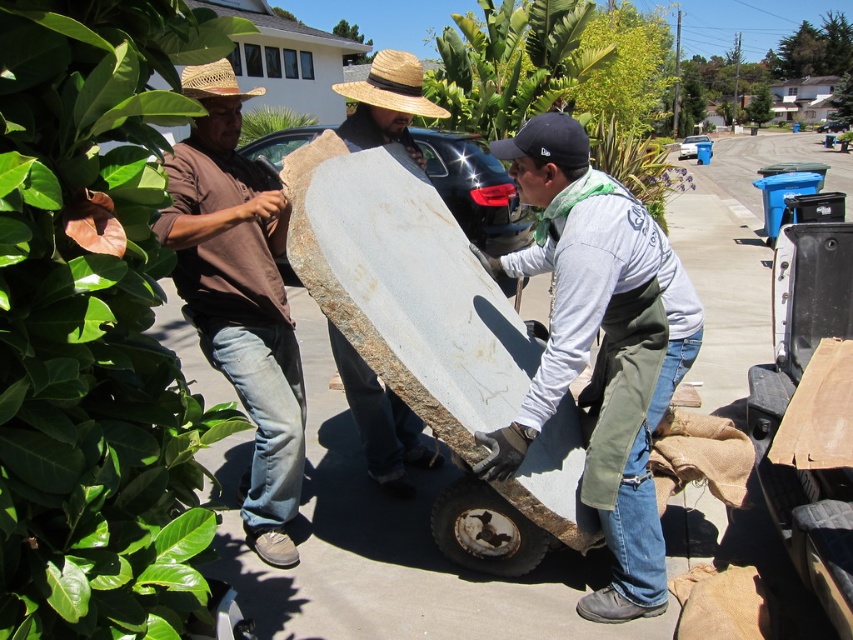
This screenshot has height=640, width=853. What are the coordinates of `matte gray concrete at center` in the screenshot? It's located at (601, 346).

Based on the photo, between matte gray concrete at center and strawhat at left, which one appears on the right side from the viewer's perspective?

Positioned to the right is matte gray concrete at center.

Does point (699, 316) come farther from viewer compared to point (189, 83)?

That is False.

What are the coordinates of `matte gray concrete at center` in the screenshot? It's located at (601, 346).

Does matte gray concrete at center have a greater height compared to brown cotton shirt at left?

In fact, matte gray concrete at center may be shorter than brown cotton shirt at left.

Looking at this image, how far apart are matte gray concrete at center and brown cotton shirt at left?

They are 4.06 feet apart.

Between point (660, 244) and point (264, 312), which one is positioned behind?

The point (264, 312) is behind.

The image size is (853, 640). What are the coordinates of `matte gray concrete at center` in the screenshot? It's located at (601, 346).

Which of these two, matte concrete slab at center or strawhat at left, stands shorter?

With less height is matte concrete slab at center.

Does matte concrete slab at center have a lesser width compared to strawhat at left?

Yes, matte concrete slab at center is thinner than strawhat at left.

Between point (402, 472) and point (183, 74), which one is positioned in front?

Positioned in front is point (183, 74).

Find the location of `matte concrete slab at center`. matte concrete slab at center is located at coordinates (380, 419).